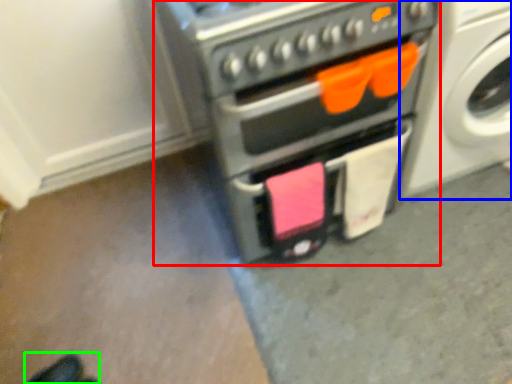
Question: Considering the real-world distances, which object is farthest from home appliance (highlighted by a red box)? washing machine (highlighted by a blue box) or footwear (highlighted by a green box)?

Choices:
 (A) washing machine
 (B) footwear

Answer: (B)